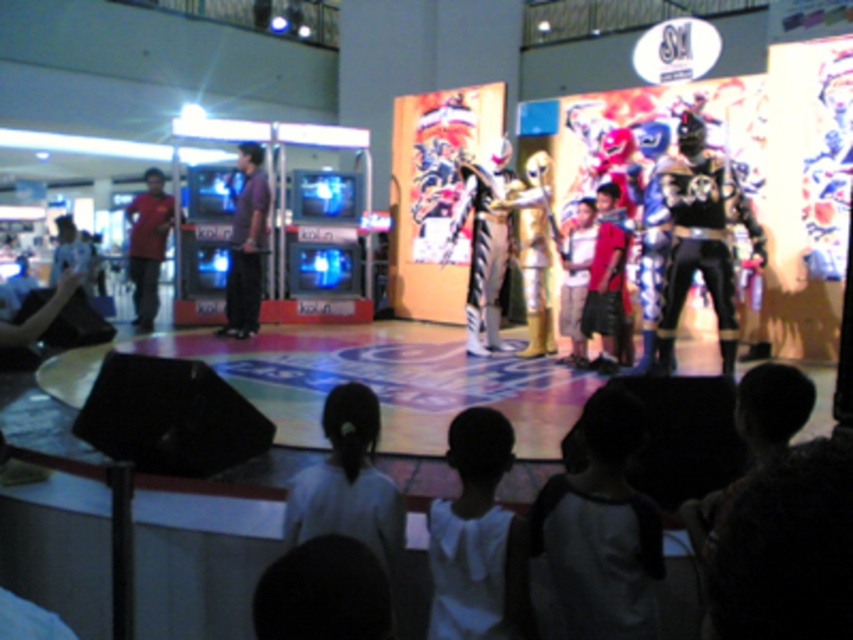
You are a photographer at the event and want to capture a photo of the purple shirt at left and the matte red shirt at left. Based on their positions, which one is positioned to the right of the other?

The purple shirt at left is positioned to the right of the matte red shirt at left.

You are a photographer at the event. You need to capture a photo where both the black metallic armor at center and the purple shirt at left are clearly visible. Given their positions, which object should you ensure is in the foreground to avoid it being obscured?

The black metallic armor at center is positioned under the purple shirt at left, so to avoid it being obscured, ensure the purple shirt at left is in the foreground.

You are a photographer at the event and need to capture a photo that includes both the white fabric shirt at lower center and the matte red shirt at left. Based on their positions, which shirt should you focus on first to ensure both are in frame?

The white fabric shirt at lower center is positioned under the matte red shirt at left, so you should focus on the matte red shirt at left first to ensure both are in frame.